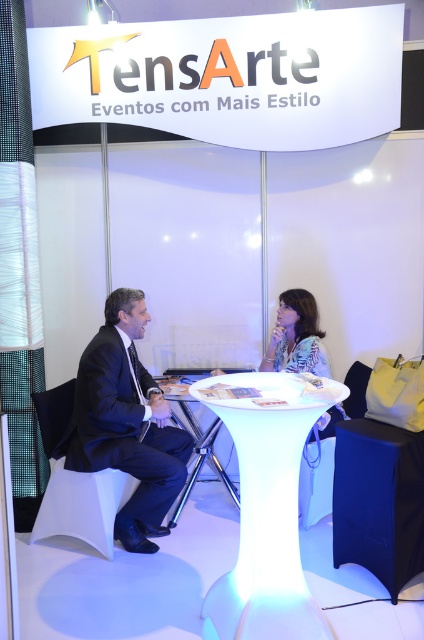
Question: Does white glossy table at center appear on the right side of white plastic table at center?

Choices:
 (A) no
 (B) yes

Answer: (B)

Question: Estimate the real-world distances between objects in this image. Which object is farther from the black suit at left?

Choices:
 (A) white glossy table at center
 (B) printed fabric blouse at center

Answer: (B)

Question: Does white glossy table at center appear on the right side of black suit at left?

Choices:
 (A) yes
 (B) no

Answer: (A)

Question: Which point appears closest to the camera in this image?

Choices:
 (A) (197, 456)
 (B) (254, 528)
 (C) (131, 301)

Answer: (B)

Question: Which point is farther to the camera?

Choices:
 (A) (181, 422)
 (B) (122, 340)
 (C) (276, 323)
 (D) (295, 452)

Answer: (A)

Question: Is printed fabric blouse at center bigger than white plastic table at center?

Choices:
 (A) no
 (B) yes

Answer: (A)